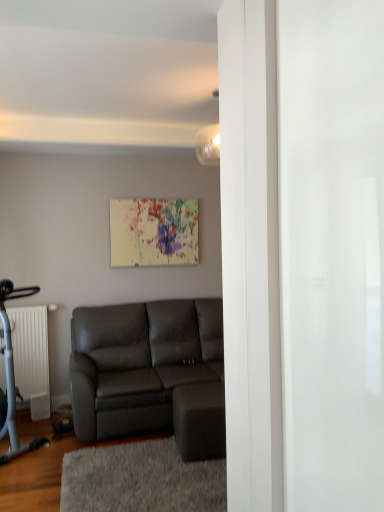
Consider the image. What is the approximate height of matte white light fixture at upper center?

It is 12.50 inches.

Locate an element on the screen. The image size is (384, 512). white matte radiator at left is located at coordinates (32, 356).

Find the location of `matte gray couch at center`. matte gray couch at center is located at coordinates (151, 373).

Considering the relative positions of matte gray couch at center and matte white light fixture at upper center in the image provided, is matte gray couch at center to the left or to the right of matte white light fixture at upper center?

matte gray couch at center is to the left of matte white light fixture at upper center.

Is matte white light fixture at upper center surrounded by matte gray couch at center?

No, matte gray couch at center does not contain matte white light fixture at upper center.

Is matte white light fixture at upper center at the back of gray textured rug at lower center?

No, gray textured rug at lower center's orientation is not away from matte white light fixture at upper center.

How much distance is there between gray textured rug at lower center and matte white light fixture at upper center?

gray textured rug at lower center and matte white light fixture at upper center are 7.47 feet apart.

At what (x,y) coordinates should I click in order to perform the action: click on yoga mat in front of the matte white light fixture at upper center. Please return your answer as a coordinate pair (x, y). Image resolution: width=384 pixels, height=512 pixels. Looking at the image, I should click on (141, 480).

Relative to matte white light fixture at upper center, is gray textured rug at lower center in front or behind?

gray textured rug at lower center is in front of matte white light fixture at upper center.

Between white matte radiator at left and gray textured rug at lower center, which one is positioned behind?

Positioned behind is white matte radiator at left.

Can you tell me how much white matte radiator at left and gray textured rug at lower center differ in facing direction?

white matte radiator at left and gray textured rug at lower center are facing 1.25 degrees away from each other.

Looking at this image, does white matte radiator at left have a greater width compared to gray textured rug at lower center?

No, white matte radiator at left is not wider than gray textured rug at lower center.

Which point is more distant from viewer, (15, 327) or (159, 442)?

The point (15, 327) is more distant.

Which is behind, point (210, 331) or point (64, 487)?

Point (210, 331)

Where is `studio couch that appears on the left of gray textured rug at lower center`? studio couch that appears on the left of gray textured rug at lower center is located at coordinates click(x=151, y=373).

Can you confirm if matte gray couch at center is positioned to the right of gray textured rug at lower center?

No.

At what (x,y) coordinates should I click in order to perform the action: click on radiator above the gray textured rug at lower center (from the image's perspective). Please return your answer as a coordinate pair (x, y). Image resolution: width=384 pixels, height=512 pixels. Looking at the image, I should click on (32, 356).

Does gray textured rug at lower center contain white matte radiator at left?

No, white matte radiator at left is not inside gray textured rug at lower center.

Are gray textured rug at lower center and white matte radiator at left beside each other?

They are not placed beside each other.

From a real-world perspective, is gray textured rug at lower center above or below white matte radiator at left?

From a real-world perspective, gray textured rug at lower center is physically below white matte radiator at left.

Does matte white light fixture at upper center turn towards matte gray couch at center?

No, matte white light fixture at upper center is not aimed at matte gray couch at center.

Considering the relative sizes of matte white light fixture at upper center and matte gray couch at center in the image provided, is matte white light fixture at upper center wider than matte gray couch at center?

Incorrect, the width of matte white light fixture at upper center does not surpass that of matte gray couch at center.

How different are the orientations of matte white light fixture at upper center and matte gray couch at center in degrees?

The angular difference between matte white light fixture at upper center and matte gray couch at center is 176 degrees.

From the image's perspective, is matte white light fixture at upper center on matte gray couch at center?

Yes, from the image's perspective, matte white light fixture at upper center is on top of matte gray couch at center.

Is matte gray couch at center not near white matte radiator at left?

That's not correct — matte gray couch at center is a little close to white matte radiator at left.

At what (x,y) coordinates should I click in order to perform the action: click on radiator above the matte gray couch at center (from the image's perspective). Please return your answer as a coordinate pair (x, y). Looking at the image, I should click on (32, 356).

Does matte gray couch at center have a lesser width compared to white matte radiator at left?

No, matte gray couch at center is not thinner than white matte radiator at left.

Considering the sizes of objects matte gray couch at center and white matte radiator at left in the image provided, who is shorter, matte gray couch at center or white matte radiator at left?

Standing shorter between the two is white matte radiator at left.

At what (x,y) coordinates should I click in order to perform the action: click on light fixture above the matte gray couch at center (from the image's perspective). Please return your answer as a coordinate pair (x, y). Looking at the image, I should click on (210, 152).

The image size is (384, 512). What are the coordinates of `yoga mat below the matte white light fixture at upper center (from the image's perspective)` in the screenshot? It's located at (141, 480).

Estimate the real-world distances between objects in this image. Which object is closer to white matte radiator at left, gray textured rug at lower center or matte white light fixture at upper center?

Among the two, gray textured rug at lower center is located nearer to white matte radiator at left.

Based on their spatial positions, is matte gray couch at center or gray textured rug at lower center further from matte white light fixture at upper center?

gray textured rug at lower center lies further to matte white light fixture at upper center than the other object.

Consider the image. When comparing their distances from white matte radiator at left, does matte gray couch at center or gray textured rug at lower center seem further?

gray textured rug at lower center is further to white matte radiator at left.

Considering their positions, is matte gray couch at center positioned further to matte white light fixture at upper center than white matte radiator at left?

Among the two, white matte radiator at left is located further to matte white light fixture at upper center.

Looking at the image, which one is located closer to white matte radiator at left, matte gray couch at center or matte white light fixture at upper center?

Among the two, matte gray couch at center is located nearer to white matte radiator at left.

Estimate the real-world distances between objects in this image. Which object is closer to gray textured rug at lower center, white matte radiator at left or matte white light fixture at upper center?

Based on the image, white matte radiator at left appears to be nearer to gray textured rug at lower center.

Based on the photo, based on their spatial positions, is white matte radiator at left or matte gray couch at center further from gray textured rug at lower center?

Among the two, white matte radiator at left is located further to gray textured rug at lower center.

From the image, which object appears to be farther from white matte radiator at left, gray textured rug at lower center or matte gray couch at center?

The object further to white matte radiator at left is gray textured rug at lower center.

You are a GUI agent. You are given a task and a screenshot of the screen. Output one action in this format:
    pyautogui.click(x=<x>, y=<y>)
    Task: Click on the studio couch that lies between matte white light fixture at upper center and gray textured rug at lower center from top to bottom
    The width and height of the screenshot is (384, 512).
    Given the screenshot: What is the action you would take?
    pyautogui.click(x=151, y=373)

Locate an element on the screen. The image size is (384, 512). radiator between matte white light fixture at upper center and matte gray couch at center in the vertical direction is located at coordinates (32, 356).

Where is `radiator between matte white light fixture at upper center and gray textured rug at lower center in the up-down direction`? This screenshot has height=512, width=384. radiator between matte white light fixture at upper center and gray textured rug at lower center in the up-down direction is located at coordinates (32, 356).

In order to click on studio couch between gray textured rug at lower center and white matte radiator at left along the z-axis in this screenshot , I will do `click(151, 373)`.